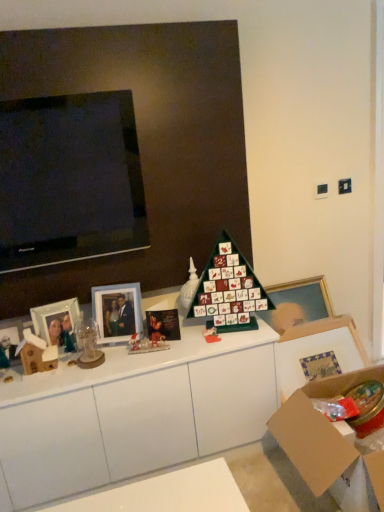
What is the approximate width of green matte advent calendar at center?

green matte advent calendar at center is 12.92 centimeters in width.

Where is `matte gold picture frame at lower right, which is the fourth picture frame in left-to-right order`? matte gold picture frame at lower right, which is the fourth picture frame in left-to-right order is located at coordinates (317, 350).

What do you see at coordinates (163, 325) in the screenshot? The image size is (384, 512). I see `glossy paper christmas card at center` at bounding box center [163, 325].

Find the location of a particular element. The image size is (384, 512). matte glass photo frame at left, marked as the 2th picture frame in a left-to-right arrangement is located at coordinates (56, 322).

What is the approximate width of matte glass picture frame at center left, acting as the third picture frame starting from the left?

The width of matte glass picture frame at center left, acting as the third picture frame starting from the left, is 3.68 inches.

In order to face wooden picture frame at left, the 1th picture frame viewed from the left, should I rotate leftwards or rightwards?

You should look left and rotate roughly 24.600 degrees.

Locate an element on the screen. The image size is (384, 512). green matte advent calendar at center is located at coordinates tap(229, 290).

Which object is positioned more to the left, matte glass photo frame at left, the third picture frame when ordered from right to left, or white glossy cabinet at center?

From the viewer's perspective, matte glass photo frame at left, the third picture frame when ordered from right to left, appears more on the left side.

Between matte glass photo frame at left, the third picture frame when ordered from right to left, and white glossy cabinet at center, which one has less height?

matte glass photo frame at left, the third picture frame when ordered from right to left.

Is point (47, 316) positioned after point (111, 419)?

Yes, it is.

Is white glossy cabinet at center not inside wooden house at left?

Absolutely, white glossy cabinet at center is external to wooden house at left.

Where is `box that is on the left side of white glossy cabinet at center`? box that is on the left side of white glossy cabinet at center is located at coordinates (36, 354).

Which object is positioned more to the left, white glossy cabinet at center or wooden house at left?

Positioned to the left is wooden house at left.

How different are the orientations of matte gold picture frame at lower right, placed as the first picture frame when sorted from right to left, and wooden picture frame at left, the 1th picture frame viewed from the left, in degrees?

5.15 degrees.

In the scene shown: Relative to wooden picture frame at left, the 1th picture frame viewed from the left, is matte gold picture frame at lower right, placed as the first picture frame when sorted from right to left, in front or behind?

Clearly, matte gold picture frame at lower right, placed as the first picture frame when sorted from right to left, is behind wooden picture frame at left, the 1th picture frame viewed from the left.

Starting from the wooden picture frame at left, the 4th picture frame viewed from the right, which picture frame is the 3rd one to the right? Please provide its 2D coordinates.

[(317, 350)]

From the image's perspective, which one is positioned higher, matte gold picture frame at lower right, which is the fourth picture frame in left-to-right order, or wooden picture frame at left, the 1th picture frame viewed from the left?

wooden picture frame at left, the 1th picture frame viewed from the left, is shown above in the image.

From a real-world perspective, between white glossy cabinet at center and matte gold picture frame at lower right, which is the fourth picture frame in left-to-right order, who is vertically lower?

white glossy cabinet at center is physically lower.

Is white glossy cabinet at center aimed at matte gold picture frame at lower right, placed as the first picture frame when sorted from right to left?

No.

Is white glossy cabinet at center next to matte gold picture frame at lower right, which is the fourth picture frame in left-to-right order, and touching it?

No, white glossy cabinet at center is not touching matte gold picture frame at lower right, which is the fourth picture frame in left-to-right order.

Can matte gold picture frame at lower right, placed as the first picture frame when sorted from right to left, be found inside white glossy cabinet at center?

No.

Is wooden house at left positioned far away from green matte advent calendar at center?

No, wooden house at left is not far away from green matte advent calendar at center.

From a real-world perspective, is wooden house at left positioned over green matte advent calendar at center based on gravity?

No, from a real-world perspective, wooden house at left is not on top of green matte advent calendar at center.

I want to click on box below the green matte advent calendar at center (from a real-world perspective), so click(x=36, y=354).

Looking at this image, is wooden house at left bigger or smaller than green matte advent calendar at center?

Clearly, wooden house at left is smaller in size than green matte advent calendar at center.

Would you consider wooden picture frame at left, the 4th picture frame viewed from the right, to be distant from glossy paper christmas card at center?

No, there isn't a large distance between wooden picture frame at left, the 4th picture frame viewed from the right, and glossy paper christmas card at center.

Does point (9, 359) come closer to viewer compared to point (176, 323)?

Yes.

Considering the relative sizes of wooden picture frame at left, the 4th picture frame viewed from the right, and glossy paper christmas card at center in the image provided, is wooden picture frame at left, the 4th picture frame viewed from the right, bigger than glossy paper christmas card at center?

No.

Is wooden picture frame at left, the 4th picture frame viewed from the right, completely or partially outside of matte gold picture frame at lower right, which is the fourth picture frame in left-to-right order?

wooden picture frame at left, the 4th picture frame viewed from the right, lies outside matte gold picture frame at lower right, which is the fourth picture frame in left-to-right order,'s area.

From the image's perspective, which object appears higher, wooden picture frame at left, the 1th picture frame viewed from the left, or matte gold picture frame at lower right, placed as the first picture frame when sorted from right to left?

wooden picture frame at left, the 1th picture frame viewed from the left.

Does wooden picture frame at left, the 1th picture frame viewed from the left, have a lesser height compared to matte gold picture frame at lower right, which is the fourth picture frame in left-to-right order?

Yes.

From a real-world perspective, is wooden picture frame at left, the 4th picture frame viewed from the right, located beneath matte gold picture frame at lower right, placed as the first picture frame when sorted from right to left?

Incorrect, from a real-world perspective, wooden picture frame at left, the 4th picture frame viewed from the right, is higher than matte gold picture frame at lower right, placed as the first picture frame when sorted from right to left.

Image resolution: width=384 pixels, height=512 pixels. Identify the location of picture frame that is the 3rd one when counting upward from the white glossy cabinet at center (from the image's perspective). (56, 322).

This screenshot has height=512, width=384. There is a white glossy cabinet at center. In order to click on box above it (from a real-world perspective) in this screenshot , I will do `click(36, 354)`.

Which object lies further to the anchor point green matte advent calendar at center, matte gold picture frame at lower right, which is the fourth picture frame in left-to-right order, or matte glass photo frame at left, the third picture frame when ordered from right to left?

matte glass photo frame at left, the third picture frame when ordered from right to left, is further to green matte advent calendar at center.

Looking at the image, which one is located closer to glossy paper christmas card at center, wooden picture frame at left, the 4th picture frame viewed from the right, or white glossy cabinet at center?

The object closer to glossy paper christmas card at center is white glossy cabinet at center.

Estimate the real-world distances between objects in this image. Which object is further from matte glass picture frame at center left, acting as the third picture frame starting from the left, white glossy cabinet at center or green matte advent calendar at center?

Based on the image, green matte advent calendar at center appears to be further to matte glass picture frame at center left, acting as the third picture frame starting from the left.

Based on their spatial positions, is matte gold picture frame at lower right, placed as the first picture frame when sorted from right to left, or white glossy cabinet at center closer to matte glass picture frame at center left, acting as the third picture frame starting from the left?

Among the two, white glossy cabinet at center is located nearer to matte glass picture frame at center left, acting as the third picture frame starting from the left.

Considering their positions, is green matte advent calendar at center positioned further to matte glass photo frame at left, the third picture frame when ordered from right to left, than matte glass picture frame at center left, positioned as the 2th picture frame in right-to-left order?

green matte advent calendar at center is further to matte glass photo frame at left, the third picture frame when ordered from right to left.

Which object lies nearer to the anchor point matte glass photo frame at left, the third picture frame when ordered from right to left, matte glass picture frame at center left, positioned as the 2th picture frame in right-to-left order, or green matte advent calendar at center?

matte glass picture frame at center left, positioned as the 2th picture frame in right-to-left order, is closer to matte glass photo frame at left, the third picture frame when ordered from right to left.

Which object lies further to the anchor point white glossy cabinet at center, glossy paper christmas card at center or wooden house at left?

wooden house at left lies further to white glossy cabinet at center than the other object.

From the image, which object appears to be farther from matte gold picture frame at lower right, placed as the first picture frame when sorted from right to left, matte glass picture frame at center left, positioned as the 2th picture frame in right-to-left order, or white glossy cabinet at center?

matte glass picture frame at center left, positioned as the 2th picture frame in right-to-left order, lies further to matte gold picture frame at lower right, placed as the first picture frame when sorted from right to left, than the other object.

Where is `picture frame between matte glass photo frame at left, the third picture frame when ordered from right to left, and matte gold picture frame at lower right, which is the fourth picture frame in left-to-right order`? The image size is (384, 512). picture frame between matte glass photo frame at left, the third picture frame when ordered from right to left, and matte gold picture frame at lower right, which is the fourth picture frame in left-to-right order is located at coordinates (117, 311).

In order to click on cabinetry located between wooden picture frame at left, the 1th picture frame viewed from the left, and glossy paper christmas card at center in the left-right direction in this screenshot , I will do `click(133, 414)`.

Find the location of a particular element. The image size is (384, 512). cabinetry between wooden picture frame at left, the 1th picture frame viewed from the left, and matte gold picture frame at lower right, placed as the first picture frame when sorted from right to left, in the horizontal direction is located at coordinates (133, 414).

The width and height of the screenshot is (384, 512). I want to click on cabinetry located between wooden picture frame at left, the 4th picture frame viewed from the right, and green matte advent calendar at center in the left-right direction, so click(133, 414).